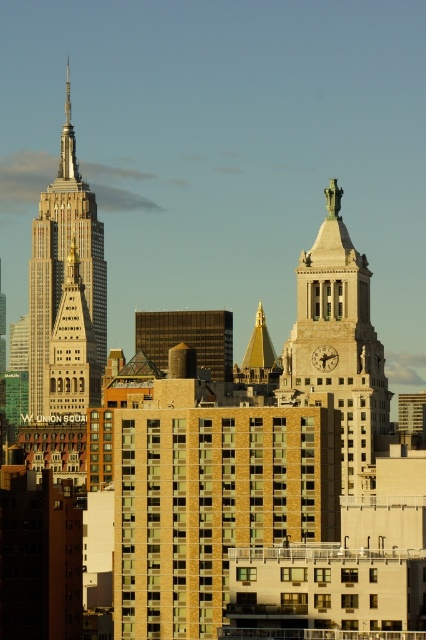
You are a city planner analyzing the skyline. The Empire State Building is on the left, and there is a golden stone clock tower at center. According to the coordinates provided, which structure is closer to the center of the image?

The golden stone clock tower at center is exactly at the coordinates provided, so it is closer to the center of the image than the Empire State Building on the left.

You are an architect planning to build a new observation deck. You have two options for the location in the cityscape image provided. The first is near the golden stone clock tower at center, and the second is near the white marble skyscraper at center. Based on their sizes, which location would allow for a larger observation deck?

The golden stone clock tower at center is bigger than the white marble skyscraper at center, so the location near the golden stone clock tower at center would allow for a larger observation deck.

You are a city planner reviewing the city layout. You need to determine which building is taller between the golden stone clock tower at center and the white marble skyscraper at center. Based on the image, which one is taller?

The white marble skyscraper at center is taller than the golden stone clock tower at center according to the image description.